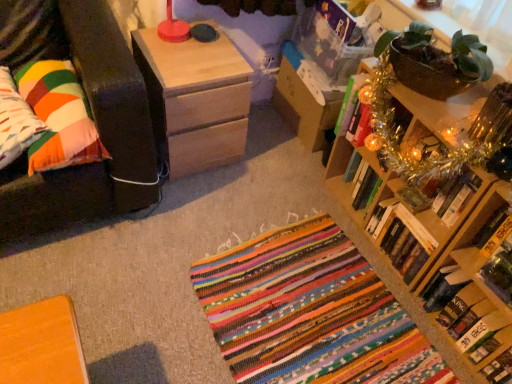
Image resolution: width=512 pixels, height=384 pixels. I want to click on metallic gold book at upper right, which is the second book from top to bottom, so click(x=443, y=194).

What do you see at coordinates (310, 313) in the screenshot? The height and width of the screenshot is (384, 512). I see `multicolored woven rug at center` at bounding box center [310, 313].

Locate an element on the screen. This screenshot has height=384, width=512. natural wood nightstand at upper left is located at coordinates (195, 100).

The width and height of the screenshot is (512, 384). What do you see at coordinates (15, 121) in the screenshot? I see `multicolored fabric pillow at left, the 1th pillow when ordered from left to right` at bounding box center [15, 121].

At what (x,y) coordinates should I click in order to perform the action: click on hardcover book at center right, which is the third book in top-to-bottom order. Please return your answer as a coordinate pair (x, y). This screenshot has height=384, width=512. Looking at the image, I should click on (401, 238).

Identify the location of metallic gold book at upper right, which is the second book from top to bottom. The image size is (512, 384). (443, 194).

From the image's perspective, is natural wood nightstand at upper left above or below hardcover book at lower right, marked as the fourth book in a top-to-bottom arrangement?

natural wood nightstand at upper left is above hardcover book at lower right, marked as the fourth book in a top-to-bottom arrangement.

Locate an element on the screen. The height and width of the screenshot is (384, 512). nightstand that appears below the hardcover book at lower right, marked as the fourth book in a top-to-bottom arrangement (from a real-world perspective) is located at coordinates (195, 100).

Which of these two, natural wood nightstand at upper left or hardcover book at lower right, arranged as the second book when ordered from the bottom, is bigger?

Bigger between the two is natural wood nightstand at upper left.

Considering the relative positions of natural wood nightstand at upper left and metallic gold book at upper right, which is the second book from top to bottom, in the image provided, is natural wood nightstand at upper left to the left or to the right of metallic gold book at upper right, which is the second book from top to bottom,?

Clearly, natural wood nightstand at upper left is on the left of metallic gold book at upper right, which is the second book from top to bottom, in the image.

Is natural wood nightstand at upper left surrounding metallic gold book at upper right, which is the second book from top to bottom?

No, natural wood nightstand at upper left does not contain metallic gold book at upper right, which is the second book from top to bottom.

Can you tell me how much natural wood nightstand at upper left and metallic gold book at upper right, the 4th book positioned from the bottom, differ in facing direction?

There is a 94.9-degree angle between the facing directions of natural wood nightstand at upper left and metallic gold book at upper right, the 4th book positioned from the bottom.

From a real-world perspective, which is physically above, natural wood nightstand at upper left or metallic gold book at upper right, which is the second book from top to bottom?

metallic gold book at upper right, which is the second book from top to bottom.

Does hardcover book at center right, the third book when ordered from bottom to top, have a larger size compared to metallic gold book at upper right, the 4th book positioned from the bottom?

Yes, hardcover book at center right, the third book when ordered from bottom to top, is bigger than metallic gold book at upper right, the 4th book positioned from the bottom.

From a real-world perspective, between hardcover book at center right, the third book when ordered from bottom to top, and metallic gold book at upper right, which is the second book from top to bottom, who is vertically higher?

metallic gold book at upper right, which is the second book from top to bottom, is physically above.

Is hardcover book at center right, which is the third book in top-to-bottom order, taller or shorter than metallic gold book at upper right, the 4th book positioned from the bottom?

Considering their sizes, hardcover book at center right, which is the third book in top-to-bottom order, has less height than metallic gold book at upper right, the 4th book positioned from the bottom.

Could metallic gold book at upper right, the 4th book positioned from the bottom, be considered to be inside hardcover book at center right, the third book when ordered from bottom to top?

No, metallic gold book at upper right, the 4th book positioned from the bottom, is not inside hardcover book at center right, the third book when ordered from bottom to top.

Can you tell me how much hardcover book at lower right, marked as the fourth book in a top-to-bottom arrangement, and metallic gold book at upper right, the 4th book positioned from the bottom, differ in facing direction?

The facing directions of hardcover book at lower right, marked as the fourth book in a top-to-bottom arrangement, and metallic gold book at upper right, the 4th book positioned from the bottom, are 4.04 degrees apart.

Which of these two, hardcover book at lower right, marked as the fourth book in a top-to-bottom arrangement, or metallic gold book at upper right, the 4th book positioned from the bottom, is wider?

With larger width is metallic gold book at upper right, the 4th book positioned from the bottom.

The height and width of the screenshot is (384, 512). Find the location of `the 1st book behind the hardcover book at lower right, marked as the fourth book in a top-to-bottom arrangement, starting your count from the anchor`. the 1st book behind the hardcover book at lower right, marked as the fourth book in a top-to-bottom arrangement, starting your count from the anchor is located at coordinates (443, 194).

Which is farther from the camera, (423, 306) or (10, 122)?

Positioned behind is point (423, 306).

Is hardcover book at lower right, arranged as the 5th book when viewed from the top, positioned far away from multicolored fabric pillow at left, marked as the 2th pillow in a right-to-left arrangement?

Yes, hardcover book at lower right, arranged as the 5th book when viewed from the top, is far from multicolored fabric pillow at left, marked as the 2th pillow in a right-to-left arrangement.

Who is bigger, hardcover book at lower right, marked as the 1th book in a bottom-to-top arrangement, or multicolored fabric pillow at left, marked as the 2th pillow in a right-to-left arrangement?

With larger size is multicolored fabric pillow at left, marked as the 2th pillow in a right-to-left arrangement.

From a real-world perspective, is hardcover book at lower right, arranged as the 5th book when viewed from the top, positioned over multicolored fabric pillow at left, marked as the 2th pillow in a right-to-left arrangement, based on gravity?

Actually, hardcover book at lower right, arranged as the 5th book when viewed from the top, is physically below multicolored fabric pillow at left, marked as the 2th pillow in a right-to-left arrangement, in the real world.

Which is behind, hardcover book at center right, which is the third book in top-to-bottom order, or natural wood nightstand at upper left?

Positioned behind is natural wood nightstand at upper left.

Considering the sizes of objects hardcover book at center right, which is the third book in top-to-bottom order, and natural wood nightstand at upper left in the image provided, who is bigger, hardcover book at center right, which is the third book in top-to-bottom order, or natural wood nightstand at upper left?

Bigger between the two is natural wood nightstand at upper left.

Which point is more distant from viewer, (407, 268) or (215, 99)?

The point (215, 99) is farther from the camera.

Looking at this image, from the image's perspective, which one is positioned lower, hardcover book at center right, which is the third book in top-to-bottom order, or natural wood nightstand at upper left?

hardcover book at center right, which is the third book in top-to-bottom order, is shown below in the image.

Considering the relative sizes of multicolored woven rug at center and multicolored fabric pillow at left, the 1th pillow when ordered from left to right, in the image provided, is multicolored woven rug at center shorter than multicolored fabric pillow at left, the 1th pillow when ordered from left to right,?

Answer: Indeed, multicolored woven rug at center has a lesser height compared to multicolored fabric pillow at left, the 1th pillow when ordered from left to right.

Is multicolored woven rug at center facing towards multicolored fabric pillow at left, marked as the 2th pillow in a right-to-left arrangement?

No.

Locate an element on the screen. Image resolution: width=512 pixels, height=384 pixels. yoga mat lying below the multicolored fabric pillow at left, the 1th pillow when ordered from left to right (from the image's perspective) is located at coordinates (310, 313).

What are the coordinates of `nightstand directly beneath the hardcover book at lower right, arranged as the second book when ordered from the bottom (from a real-world perspective)` in the screenshot? It's located at (195, 100).

At what (x,y) coordinates should I click in order to perform the action: click on nightstand lying behind the metallic gold book at upper right, which is the second book from top to bottom. Please return your answer as a coordinate pair (x, y). The width and height of the screenshot is (512, 384). Looking at the image, I should click on (195, 100).

Based on their spatial positions, is hardcover book at lower right, arranged as the 5th book when viewed from the top, or hardcover book at lower right, marked as the fourth book in a top-to-bottom arrangement, further from multicolored fabric pillow at left, the 1th pillow when ordered from left to right?

hardcover book at lower right, marked as the fourth book in a top-to-bottom arrangement, is further to multicolored fabric pillow at left, the 1th pillow when ordered from left to right.

Considering their positions, is hardcover book at upper right, marked as the first book in a top-to-bottom arrangement, positioned further to wooden bookcase at upper right than hardcover book at center right, which is the third book in top-to-bottom order?

Based on the image, hardcover book at upper right, marked as the first book in a top-to-bottom arrangement, appears to be further to wooden bookcase at upper right.

Looking at the image, which one is located further to hardcover book at upper right, marked as the first book in a top-to-bottom arrangement, wooden bookcase at upper right or hardcover book at lower right, arranged as the 5th book when viewed from the top?

hardcover book at lower right, arranged as the 5th book when viewed from the top, is further to hardcover book at upper right, marked as the first book in a top-to-bottom arrangement.

Estimate the real-world distances between objects in this image. Which object is further from metallic gold book at upper right, which is the second book from top to bottom, natural wood nightstand at upper left or hardcover book at upper right, marked as the first book in a top-to-bottom arrangement?

Based on the image, natural wood nightstand at upper left appears to be further to metallic gold book at upper right, which is the second book from top to bottom.

Looking at the image, which one is located closer to hardcover book at upper right, the fifth book positioned from the bottom, hardcover book at center right, the third book when ordered from bottom to top, or metallic gold book at upper right, the 4th book positioned from the bottom?

metallic gold book at upper right, the 4th book positioned from the bottom.

Which object lies further to the anchor point multicolored fabric pillow at left, marked as the 2th pillow in a right-to-left arrangement, natural wood nightstand at upper left or hardcover book at upper right, the fifth book positioned from the bottom?

hardcover book at upper right, the fifth book positioned from the bottom, lies further to multicolored fabric pillow at left, marked as the 2th pillow in a right-to-left arrangement, than the other object.

Which object lies further to the anchor point multicolored fabric pillow at left, the 2th pillow from the left, wooden bookcase at upper right or multicolored woven rug at center?

wooden bookcase at upper right lies further to multicolored fabric pillow at left, the 2th pillow from the left, than the other object.

Which object lies further to the anchor point multicolored fabric pillow at left, which appears as the first pillow when viewed from the right, hardcover book at upper right, marked as the first book in a top-to-bottom arrangement, or hardcover book at center right, which is the third book in top-to-bottom order?

The object further to multicolored fabric pillow at left, which appears as the first pillow when viewed from the right, is hardcover book at center right, which is the third book in top-to-bottom order.

This screenshot has width=512, height=384. What are the coordinates of `yoga mat situated between multicolored fabric pillow at left, the 1th pillow when ordered from left to right, and metallic gold book at upper right, which is the second book from top to bottom, from left to right` in the screenshot? It's located at (310, 313).

The height and width of the screenshot is (384, 512). I want to click on book between metallic gold book at upper right, the 4th book positioned from the bottom, and hardcover book at lower right, arranged as the second book when ordered from the bottom, in the up-down direction, so click(x=401, y=238).

The width and height of the screenshot is (512, 384). Identify the location of pillow between multicolored fabric pillow at left, the 1th pillow when ordered from left to right, and natural wood nightstand at upper left. (59, 117).

At what (x,y) coordinates should I click in order to perform the action: click on yoga mat between multicolored fabric pillow at left, the 2th pillow from the left, and hardcover book at lower right, arranged as the 5th book when viewed from the top, in the horizontal direction. Please return your answer as a coordinate pair (x, y). Looking at the image, I should click on click(310, 313).